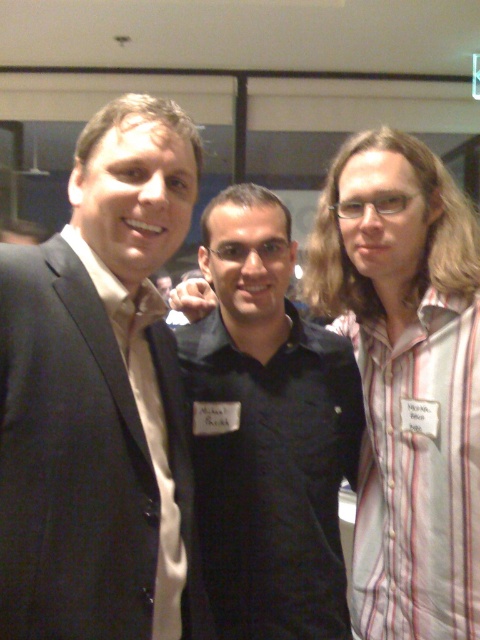
You are standing in the room and want to locate the matte black suit at left. Which area should you look towards? Please provide coordinates in the format of x,y where x is the horizontal axis from left to right and y is the vertical axis from bottom to top.

The matte black suit at left is located at coordinates (98,394). So you should look towards the area at x 0.616 and y 0.206.

You are standing at point [156,307] and want to move to point [271,624]. Is the path between these two points clear of any obstacles?

Point [271,624] is behind point [156,307], so the path between them is blocked by the object at point [156,307].

You are standing in the room where the photo was taken. There is a black matte shirt at center located at point (x=267, y=432). If you want to move towards the black matte shirt at center, which direction should you move from your current position?

The black matte shirt at center is located at point (x=267, y=432). To move towards it, you should move towards the coordinates specified, which would be the center area of the room.